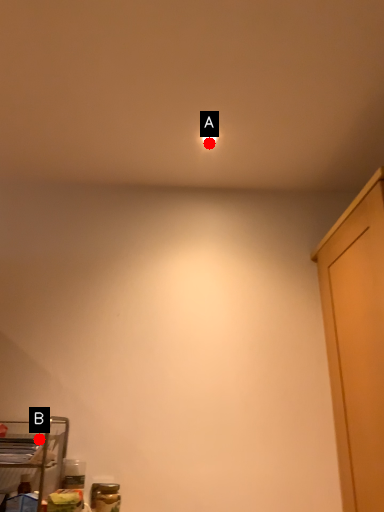
Question: Two points are circled on the image, labeled by A and B beside each circle. Which point is closer to the camera taking this photo?

Choices:
 (A) A is closer
 (B) B is closer

Answer: (B)